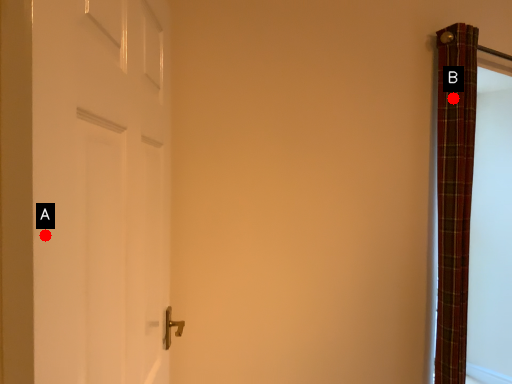
Question: Two points are circled on the image, labeled by A and B beside each circle. Which of the following is the closest to the observer?

Choices:
 (A) A is closer
 (B) B is closer

Answer: (A)